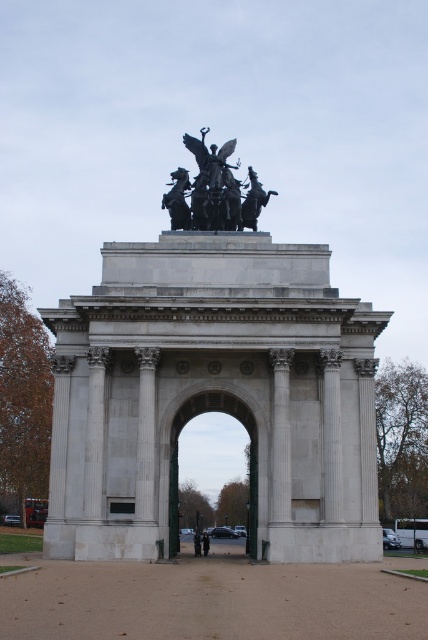
Who is higher up, white stone arch at center or polished bronze statue at upper center?

Positioned higher is polished bronze statue at upper center.

Does white stone arch at center have a larger size compared to polished bronze statue at upper center?

Correct, white stone arch at center is larger in size than polished bronze statue at upper center.

Which is in front, point (208, 161) or point (178, 216)?

Point (178, 216) is in front.

Locate an element on the screen. The image size is (428, 640). white stone arch at center is located at coordinates (214, 385).